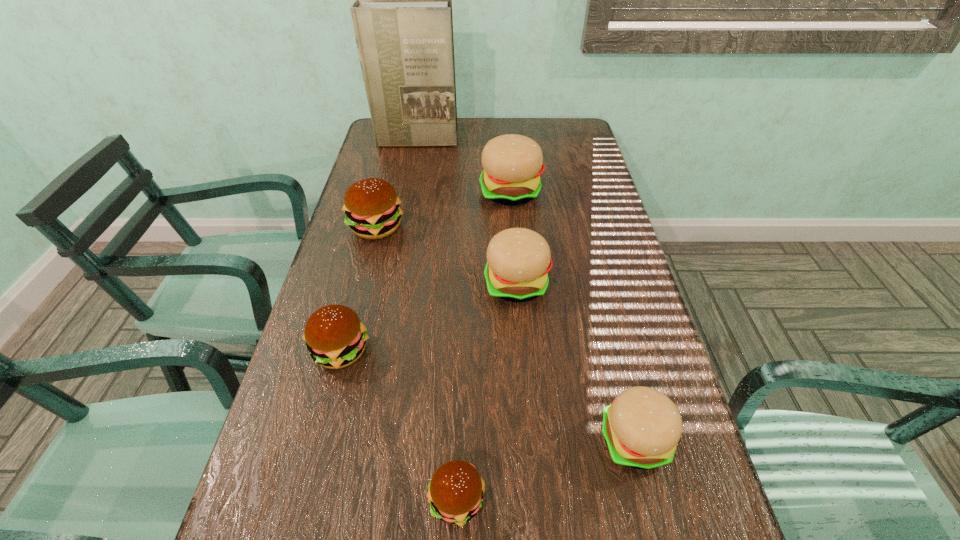
At what (x,y) coordinates should I click in order to perform the action: click on brown hamburger that is the closest to the farthest brown hamburger. Please return your answer as a coordinate pair (x, y). Looking at the image, I should click on (x=335, y=337).

Where is `blank area in the image that satisfies the following two spatial constraints: 1. on the back side of the third nearest hamburger; 2. on the left side of the biggest brown hamburger`? This screenshot has height=540, width=960. blank area in the image that satisfies the following two spatial constraints: 1. on the back side of the third nearest hamburger; 2. on the left side of the biggest brown hamburger is located at coordinates (373, 227).

Identify the location of vacant point that satisfies the following two spatial constraints: 1. on the back side of the farthest brown hamburger; 2. on the left side of the farthest beige hamburger. (385, 192).

I want to click on vacant space that satisfies the following two spatial constraints: 1. on the back side of the biggest brown hamburger; 2. on the left side of the farthest beige hamburger, so click(x=385, y=192).

Find the location of a particular element. free space that satisfies the following two spatial constraints: 1. on the cover of the tallest object; 2. on the right side of the second smallest beige hamburger is located at coordinates (388, 284).